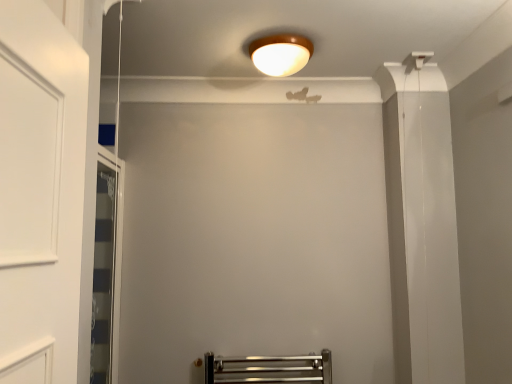
The height and width of the screenshot is (384, 512). What do you see at coordinates (280, 54) in the screenshot? I see `wooden ceiling light at upper center` at bounding box center [280, 54].

You are a GUI agent. You are given a task and a screenshot of the screen. Output one action in this format:
    pyautogui.click(x=<x>, y=<y>)
    Task: Click on the wooden ceiling light at upper center
    The image size is (512, 384).
    Given the screenshot: What is the action you would take?
    pyautogui.click(x=280, y=54)

Find the location of a particular element. The height and width of the screenshot is (384, 512). wooden ceiling light at upper center is located at coordinates (280, 54).